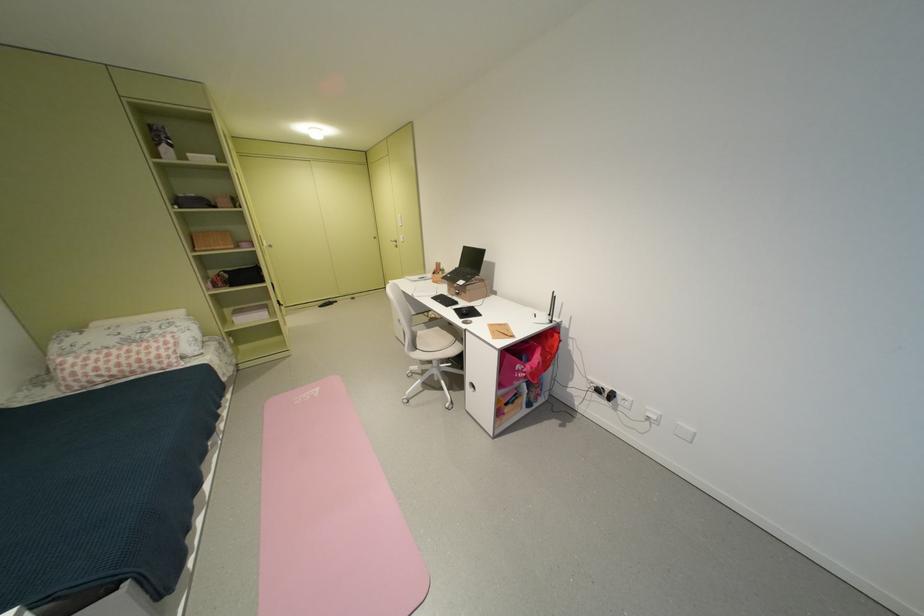
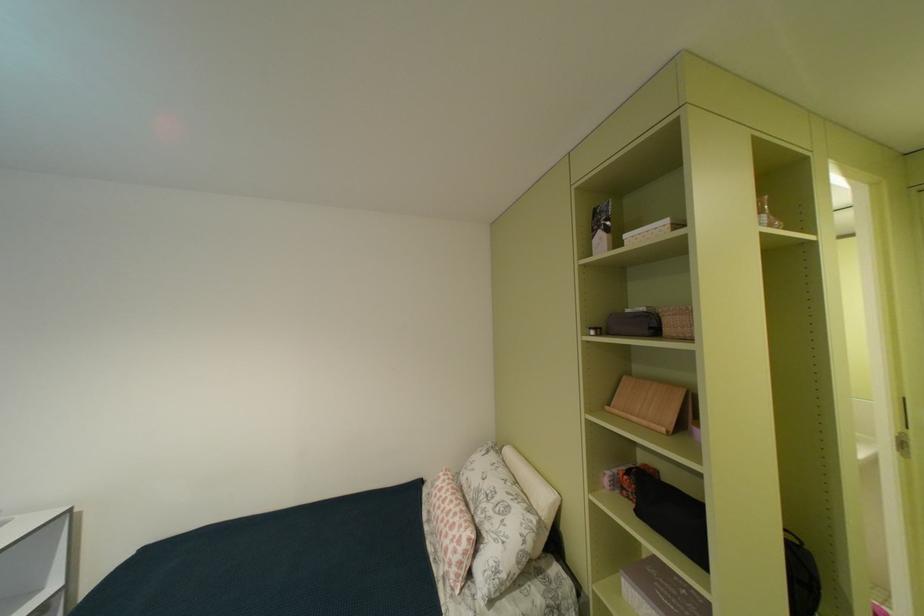
In the second image, find the point that corresponds to (x=128, y=341) in the first image.

(487, 487)